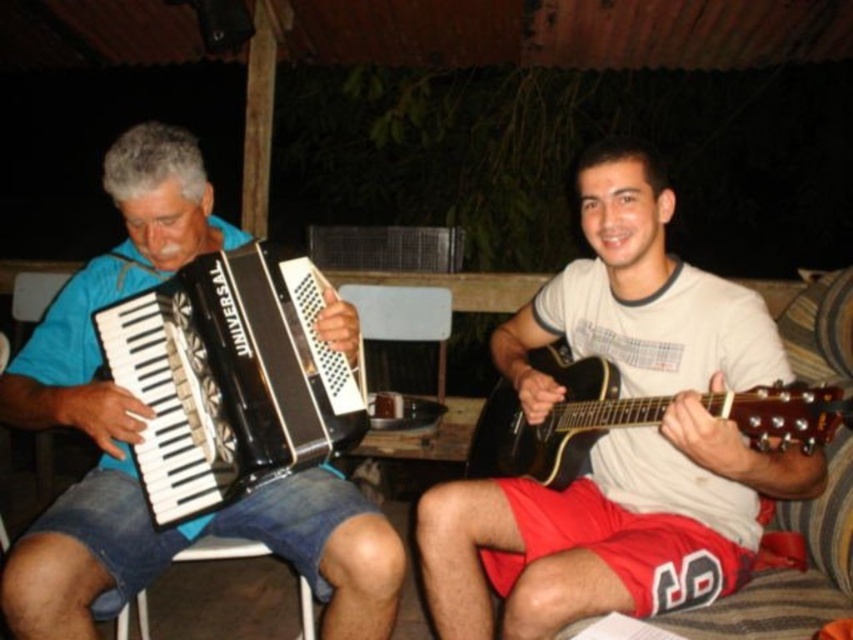
Does white matte guitar at right appear on the right side of black matte accordion at left?

Yes, white matte guitar at right is to the right of black matte accordion at left.

Can you confirm if white matte guitar at right is positioned to the left of black matte accordion at left?

In fact, white matte guitar at right is to the right of black matte accordion at left.

Who is more distant from viewer, (566, 572) or (28, 579)?

The point (566, 572) is more distant.

Where is `white matte guitar at right`? Image resolution: width=853 pixels, height=640 pixels. white matte guitar at right is located at coordinates (619, 436).

Is black matte accordion at left closer to camera compared to black plastic accordion at left?

That is True.

Is point (55, 380) in front of point (310, 291)?

No, it is behind (310, 291).

This screenshot has height=640, width=853. Find the location of `black matte accordion at left`. black matte accordion at left is located at coordinates (142, 426).

Which is in front, point (842, 317) or point (799, 404)?

Positioned in front is point (799, 404).

Who is more distant from viewer, (827,609) or (849,397)?

The point (827,609) is behind.

Image resolution: width=853 pixels, height=640 pixels. In order to click on suede-like fabric couch at right in this screenshot , I will do `click(791, 570)`.

Find the location of a particular element. Image resolution: width=853 pixels, height=640 pixels. suede-like fabric couch at right is located at coordinates (791, 570).